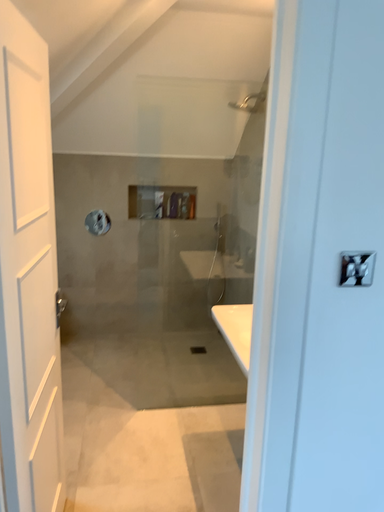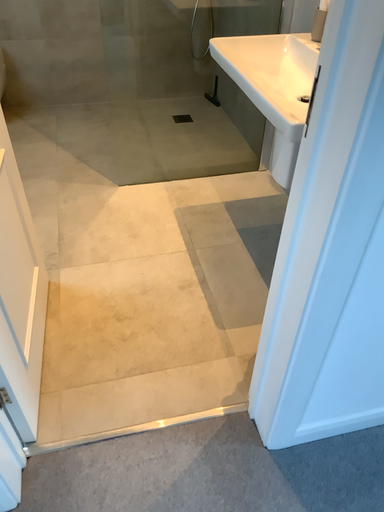
Question: Which way did the camera rotate in the video?

Choices:
 (A) rotated upward
 (B) rotated downward

Answer: (B)